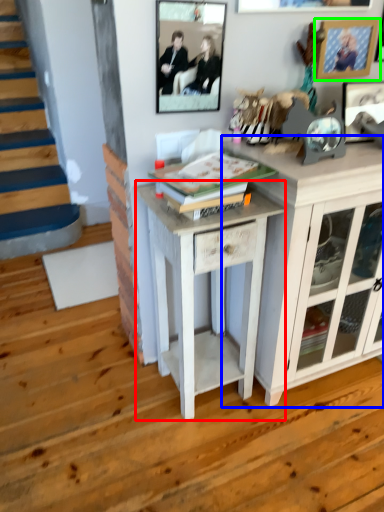
Question: Which object is positioned farthest from table (highlighted by a red box)? Select from cabinetry (highlighted by a blue box) and picture frame (highlighted by a green box).

Choices:
 (A) cabinetry
 (B) picture frame

Answer: (B)